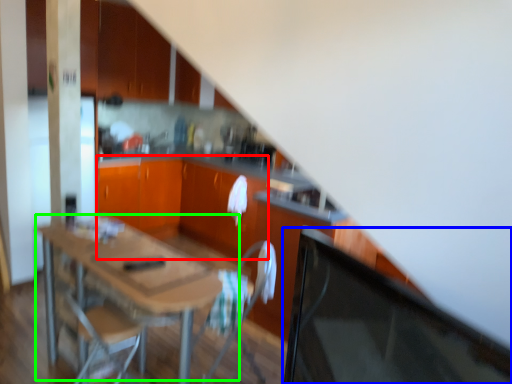
Question: Which is farther away from cabinetry (highlighted by a red box)? computer monitor (highlighted by a blue box) or table (highlighted by a green box)?

Choices:
 (A) computer monitor
 (B) table

Answer: (B)